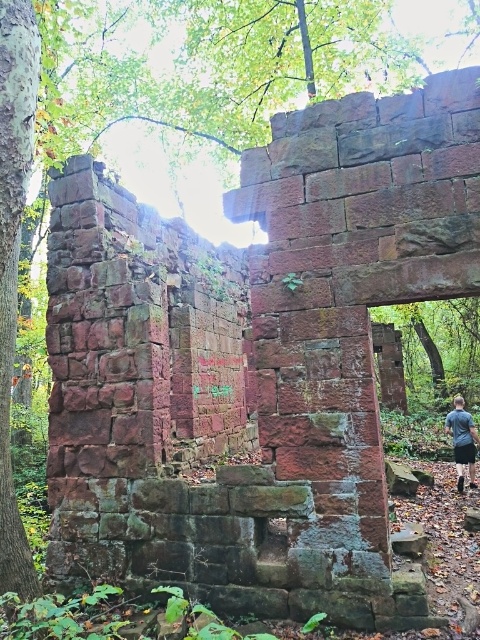
Question: Which point is farther from the camera taking this photo?

Choices:
 (A) (22, 1)
 (B) (474, 440)

Answer: (B)

Question: Where is smooth bark tree at left located in relation to dark gray shirt at lower right in the image?

Choices:
 (A) right
 (B) left

Answer: (B)

Question: Is smooth bark tree at left positioned in front of dark gray shirt at lower right?

Choices:
 (A) yes
 (B) no

Answer: (A)

Question: Can you confirm if smooth bark tree at left is bigger than dark gray shirt at lower right?

Choices:
 (A) no
 (B) yes

Answer: (B)